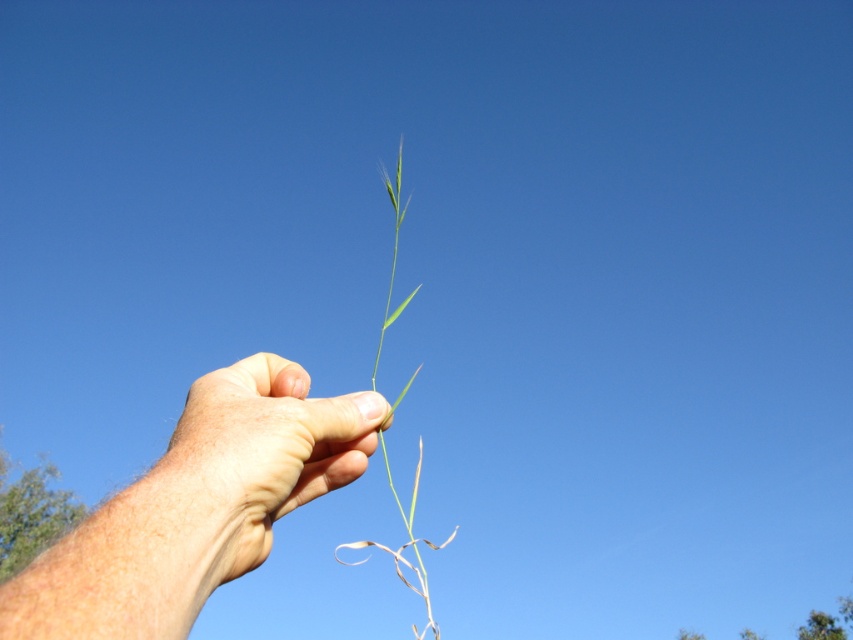
Question: Among these points, which one is nearest to the camera?

Choices:
 (A) (189, 442)
 (B) (276, 474)

Answer: (A)

Question: Is skinny green stem at center behind green matte grass at center?

Choices:
 (A) no
 (B) yes

Answer: (A)

Question: Which point is closer to the camera?

Choices:
 (A) (364, 545)
 (B) (223, 499)

Answer: (B)

Question: In this image, where is skinny green leaf at center located relative to green matte grass at center?

Choices:
 (A) above
 (B) below

Answer: (A)

Question: Estimate the real-world distances between objects in this image. Which object is farther from the green matte grass at center?

Choices:
 (A) skinny green leaf at center
 (B) skinny green stem at center

Answer: (B)

Question: Is skinny green stem at center to the right of green matte grass at center from the viewer's perspective?

Choices:
 (A) no
 (B) yes

Answer: (A)